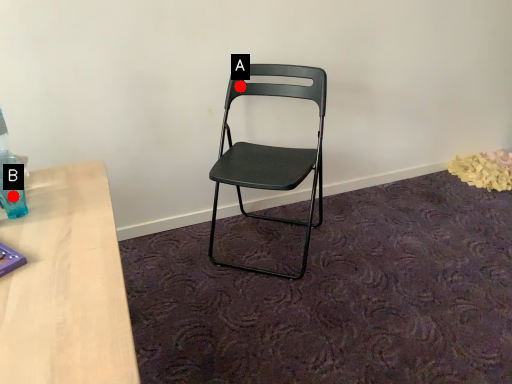
Question: Two points are circled on the image, labeled by A and B beside each circle. Which point is closer to the camera taking this photo?

Choices:
 (A) A is closer
 (B) B is closer

Answer: (B)